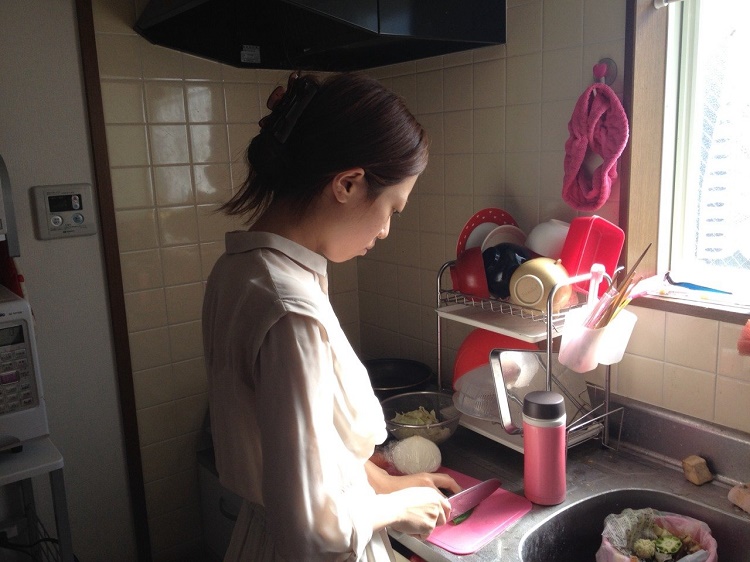
I want to click on pink cloth, so click(614, 120).